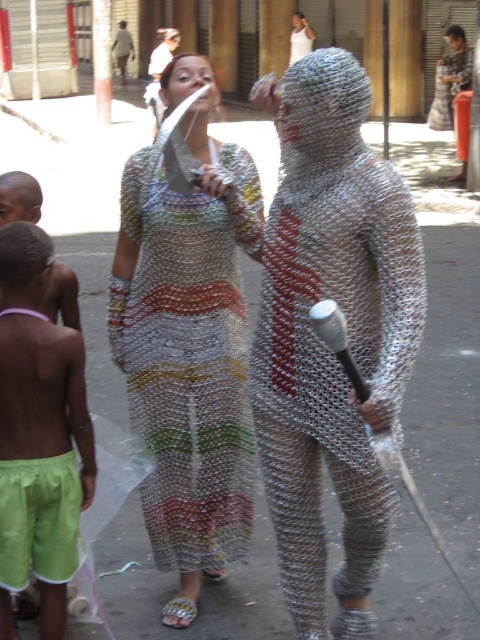
Question: Among these objects, which one is farthest from the camera?

Choices:
 (A) white tank top at upper center
 (B) green fabric shorts at lower left

Answer: (A)

Question: Can you confirm if chainmail armor at center is thinner than multicolored mesh dress at center?

Choices:
 (A) yes
 (B) no

Answer: (A)

Question: Based on their relative distances, which object is nearer to the green fabric shorts at lower left?

Choices:
 (A) metallic chainmail suit at upper right
 (B) multicolored mesh dress at center
 (C) white tank top at upper center

Answer: (B)

Question: Which point appears closest to the camera in this image?

Choices:
 (A) (228, 481)
 (B) (47, 438)

Answer: (B)

Question: Can you confirm if chainmail armor at center is wider than multicolored mesh dress at center?

Choices:
 (A) yes
 (B) no

Answer: (B)

Question: Where is metallic chainmail suit at upper right located in relation to white tank top at upper center in the image?

Choices:
 (A) left
 (B) right

Answer: (B)